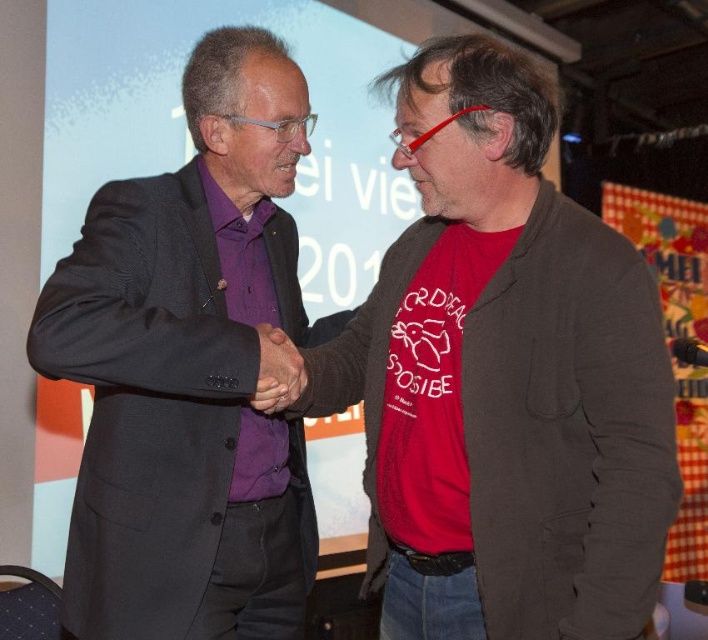
Is matte brown jacket at center smaller than matte black hand at center?

No.

The image size is (708, 640). Identify the location of matte brown jacket at center. coord(503,380).

Looking at this image, how far apart are matte brown jacket at center and purple matte suit at center?

Answer: matte brown jacket at center and purple matte suit at center are 13.44 inches apart from each other.

Does point (455, 342) lie in front of point (67, 634)?

Yes, point (455, 342) is closer to viewer.

Locate an element on the screen. The width and height of the screenshot is (708, 640). matte brown jacket at center is located at coordinates (503, 380).

Consider the image. Between purple matte suit at center and matte black hand at center, which one is positioned lower?

matte black hand at center is below.

Is purple matte suit at center to the right of matte black hand at center from the viewer's perspective?

In fact, purple matte suit at center is to the left of matte black hand at center.

The height and width of the screenshot is (640, 708). What do you see at coordinates (190, 371) in the screenshot?
I see `purple matte suit at center` at bounding box center [190, 371].

At what (x,y) coordinates should I click in order to perform the action: click on purple matte suit at center. Please return your answer as a coordinate pair (x, y). This screenshot has width=708, height=640. Looking at the image, I should click on (190, 371).